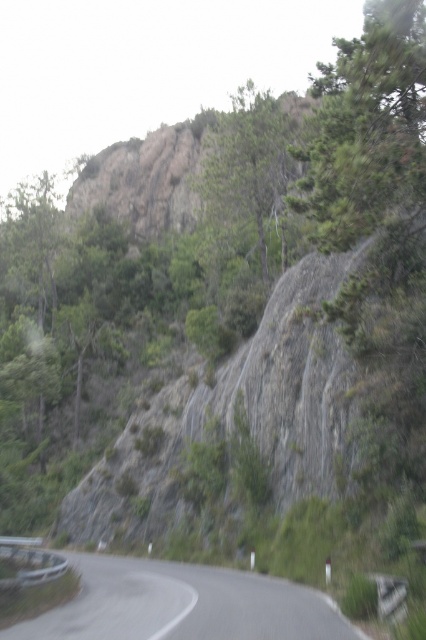
Between green textured tree at upper right and green leafy tree at upper center, which one is positioned lower?

green textured tree at upper right is below.

Between green textured tree at upper right and green leafy tree at upper center, which one appears on the left side from the viewer's perspective?

From the viewer's perspective, green leafy tree at upper center appears more on the left side.

What do you see at coordinates (367, 128) in the screenshot? This screenshot has width=426, height=640. I see `green textured tree at upper right` at bounding box center [367, 128].

This screenshot has height=640, width=426. What are the coordinates of `green textured tree at upper right` in the screenshot? It's located at (367, 128).

What do you see at coordinates (184, 604) in the screenshot?
I see `gray asphalt road at lower center` at bounding box center [184, 604].

Image resolution: width=426 pixels, height=640 pixels. What are the coordinates of `gray asphalt road at lower center` in the screenshot? It's located at (184, 604).

Consider the image. Does green textured tree at upper right have a larger size compared to gray asphalt road at lower center?

Indeed, green textured tree at upper right has a larger size compared to gray asphalt road at lower center.

From the picture: Is green textured tree at upper right to the left of gray asphalt road at lower center from the viewer's perspective?

Incorrect, green textured tree at upper right is not on the left side of gray asphalt road at lower center.

Find the location of a particular element. green textured tree at upper right is located at coordinates (367, 128).